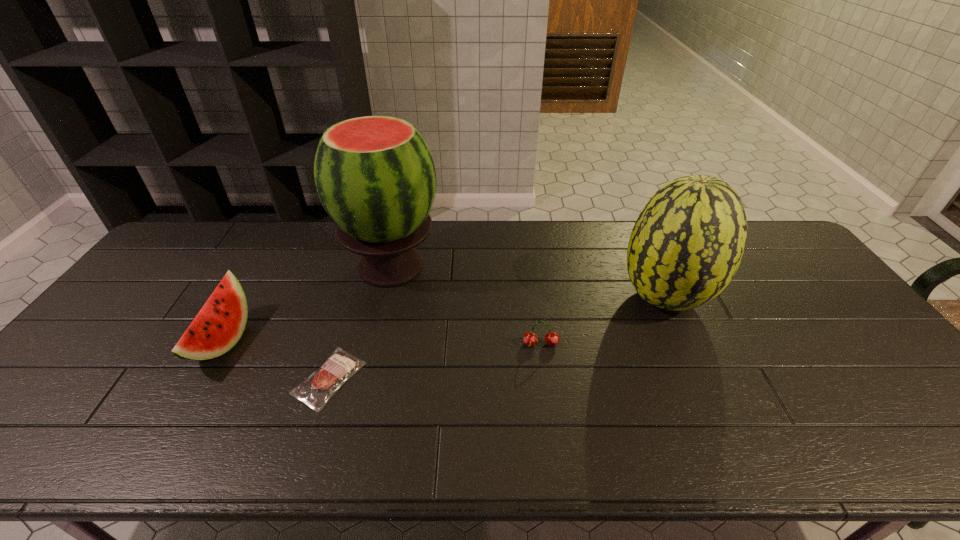
At what (x,y) coordinates should I click in order to perform the action: click on the second closest object to the shortest watermelon. Please return your answer as a coordinate pair (x, y). The height and width of the screenshot is (540, 960). Looking at the image, I should click on (375, 176).

Select which watermelon is the closest to the second watermelon from left to right. Please provide its 2D coordinates. Your answer should be formatted as a tuple, i.e. [(x, y)], where the tuple contains the x and y coordinates of a point satisfying the conditions above.

[(220, 323)]

Locate which watermelon ranks third in proximity to the steak. Please provide its 2D coordinates. Your answer should be formatted as a tuple, i.e. [(x, y)], where the tuple contains the x and y coordinates of a point satisfying the conditions above.

[(688, 241)]

Find the location of `vacant space that satisfies the following two spatial constraints: 1. on the outer rind of the shortest object; 2. on the left side of the leftmost watermelon`. vacant space that satisfies the following two spatial constraints: 1. on the outer rind of the shortest object; 2. on the left side of the leftmost watermelon is located at coordinates (202, 378).

I want to click on free space that satisfies the following two spatial constraints: 1. on the outer rind of the shortest object; 2. on the right side of the leftmost object, so click(202, 378).

You are a GUI agent. You are given a task and a screenshot of the screen. Output one action in this format:
    pyautogui.click(x=<x>, y=<y>)
    Task: Click on the free spot that satisfies the following two spatial constraints: 1. on the back side of the shortest object; 2. on the outer rind of the leftmost watermelon
    
    Given the screenshot: What is the action you would take?
    pyautogui.click(x=341, y=341)